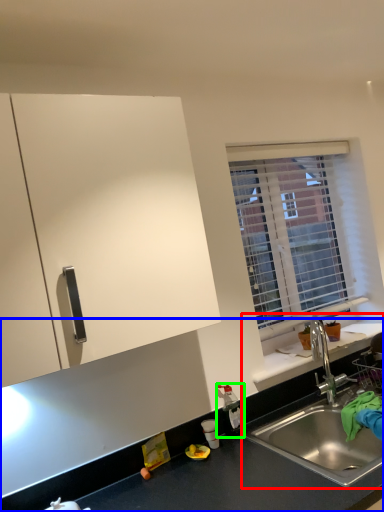
Question: Considering the real-world distances, which object is farthest from sink (highlighted by a red box)? countertop (highlighted by a blue box) or bottle (highlighted by a green box)?

Choices:
 (A) countertop
 (B) bottle

Answer: (B)